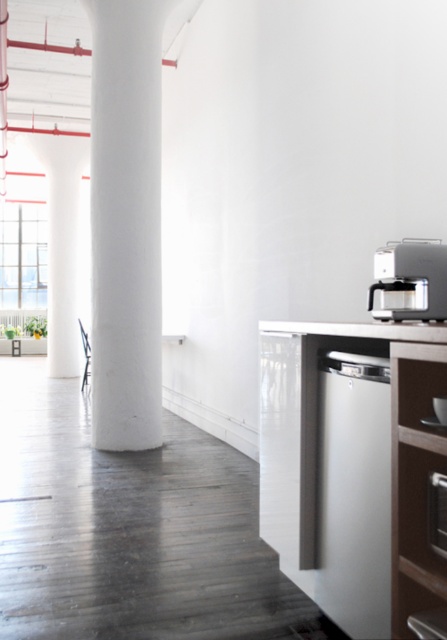
You are a kitchen designer trying to install a new appliance. You have a white glossy dishwasher at lower right and a white smooth column at center in the kitchen. Which object is shorter?

The white glossy dishwasher at lower right is shorter than the white smooth column at center.

You are standing in the kitchen and want to reach a point that is exactly at the coordinate point (439, 337). If your arm can reach up to 1.5 meters, can you touch that point without moving your feet?

The distance between you and the point (439, 337) is 1.48 meters, which is within your arm reach of 1.5 meters. Therefore, you can touch the point without moving your feet.

You are organizing a kitchen layout and need to place the metallic silver chair at center next to the white glossy dishwasher at lower right. Based on their sizes, which object should be placed first to ensure they fit properly?

The white glossy dishwasher at lower right is wider than the metallic silver chair at center. Therefore, you should place the white glossy dishwasher at lower right first to accommodate its larger width before positioning the metallic silver chair at center.